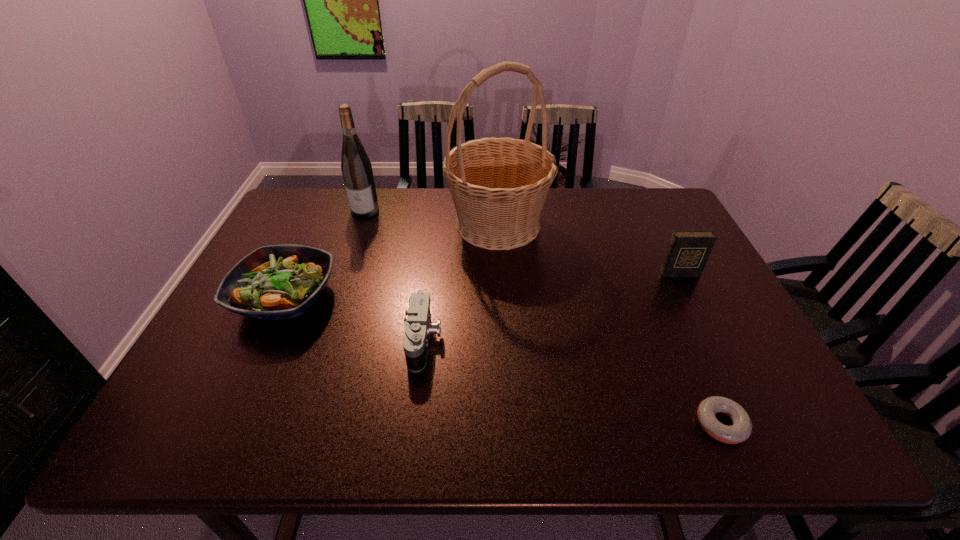
Identify the location of blank space at the far edge. (592, 219).

Locate an element on the screen. vacant position at the near edge of the desktop is located at coordinates [x=309, y=433].

This screenshot has height=540, width=960. In the image, there is a desktop. In order to click on blank space at the left edge in this screenshot , I will do `click(227, 329)`.

In the image, there is a desktop. Where is `vacant region at the right edge`? vacant region at the right edge is located at coordinates (676, 291).

You are a GUI agent. You are given a task and a screenshot of the screen. Output one action in this format:
    pyautogui.click(x=<x>, y=<y>)
    Task: Click on the vacant area between the third tallest object and the doughnut
    The height and width of the screenshot is (540, 960).
    Given the screenshot: What is the action you would take?
    [700, 349]

You are a GUI agent. You are given a task and a screenshot of the screen. Output one action in this format:
    pyautogui.click(x=<x>, y=<y>)
    Task: Click on the vacant point located between the fourth shortest object and the camera
    
    Given the screenshot: What is the action you would take?
    551,307

Find the location of `free space between the wine bottle and the tallest object`. free space between the wine bottle and the tallest object is located at coordinates (432, 217).

Locate an element on the screen. The width and height of the screenshot is (960, 540). vacant area between the tallest object and the diary is located at coordinates (588, 249).

I want to click on free spot between the diary and the second shortest object, so click(551, 307).

You are a GUI agent. You are given a task and a screenshot of the screen. Output one action in this format:
    pyautogui.click(x=<x>, y=<y>)
    Task: Click on the free space between the wine bottle and the second shortest object
    
    Given the screenshot: What is the action you would take?
    pyautogui.click(x=395, y=275)